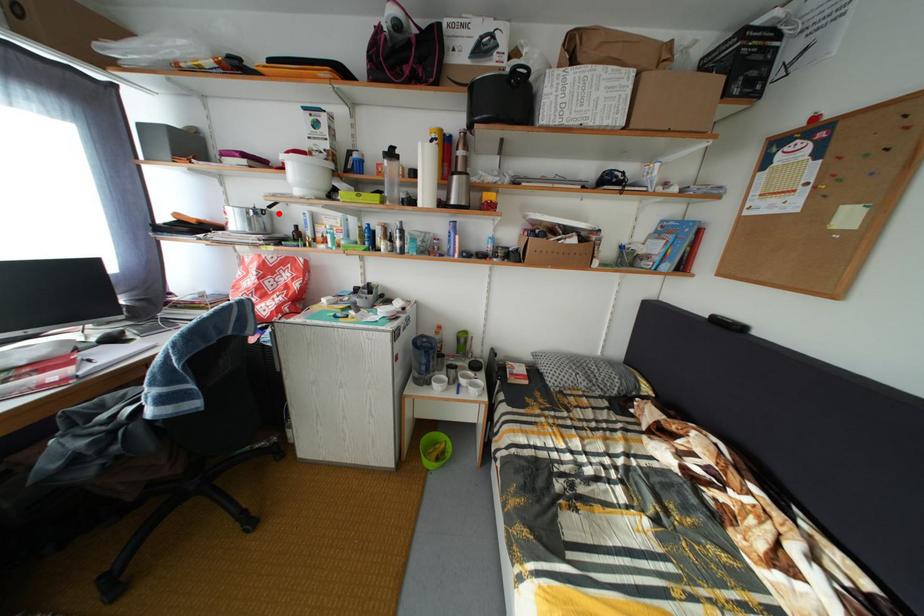
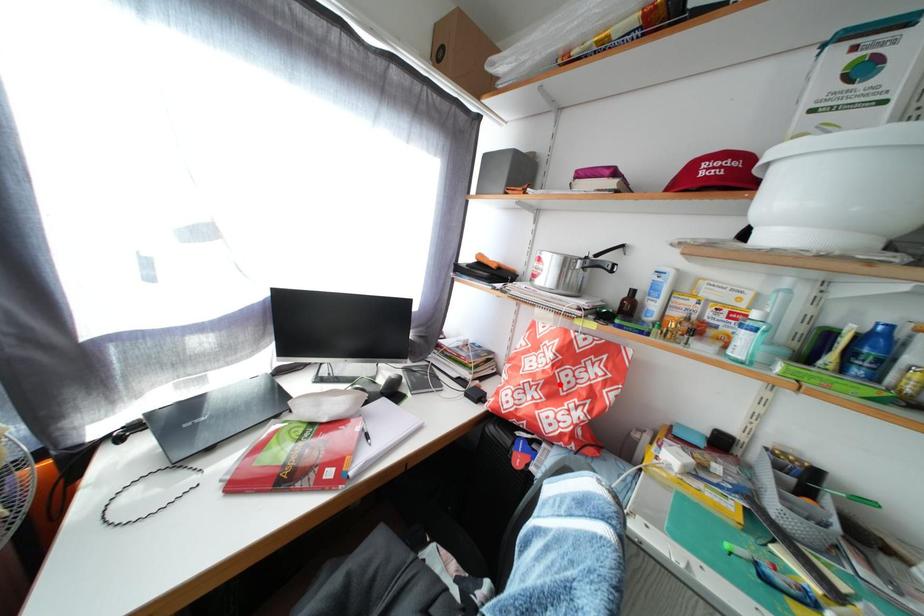
I am providing you with two images of the same scene from different viewpoints. A red point is marked on the first image and another point is marked on the second image. Do the highlighted points in image1 and image2 indicate the same real-world spot?

No